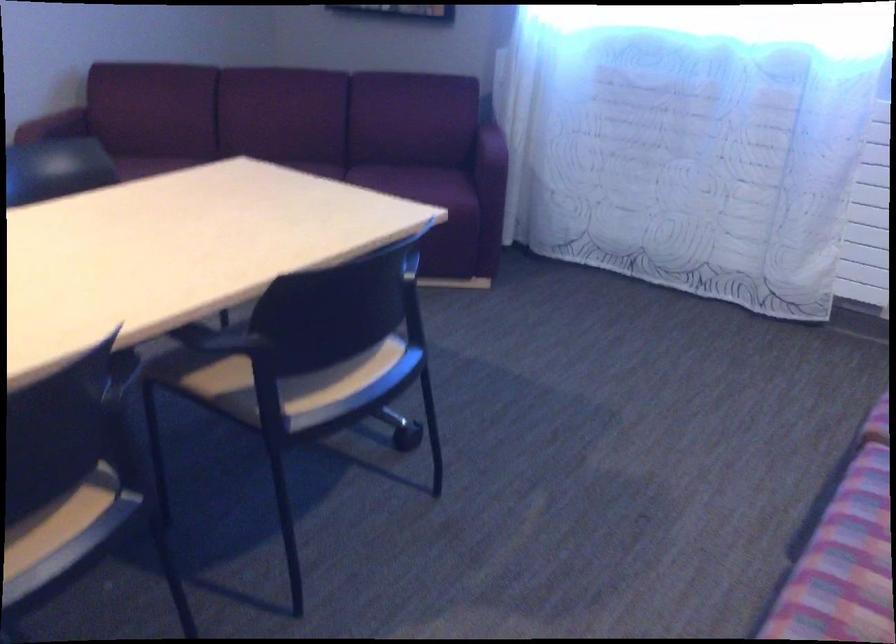
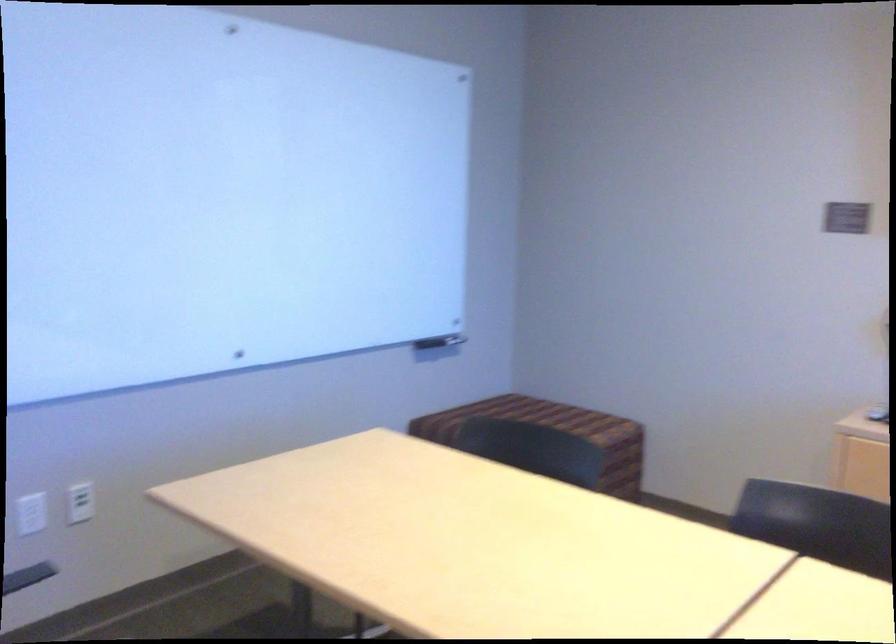
Question: The first image is from the beginning of the video and the second image is from the end. How did the camera likely rotate when shooting the video?

Choices:
 (A) Left
 (B) Right
 (C) Up
 (D) Down

Answer: (A)